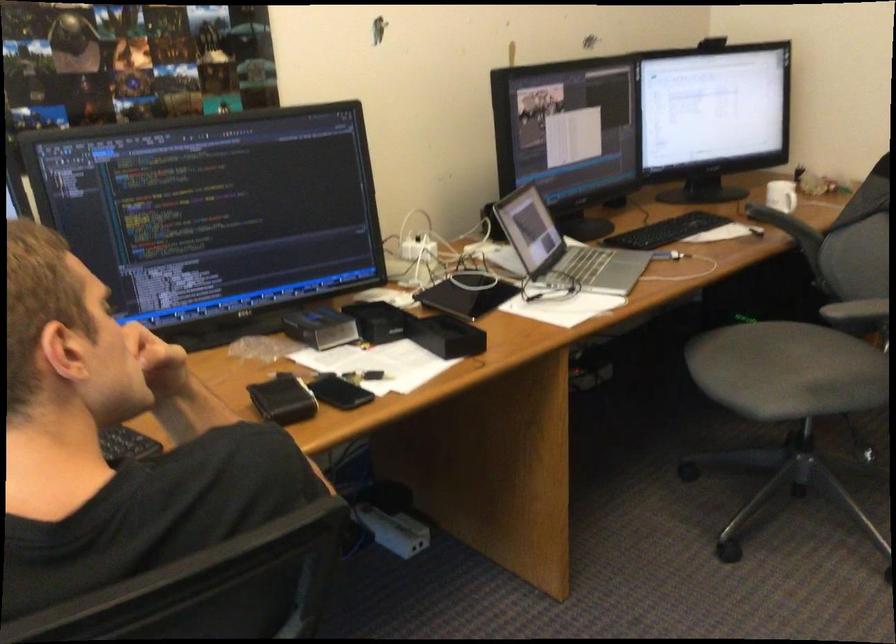
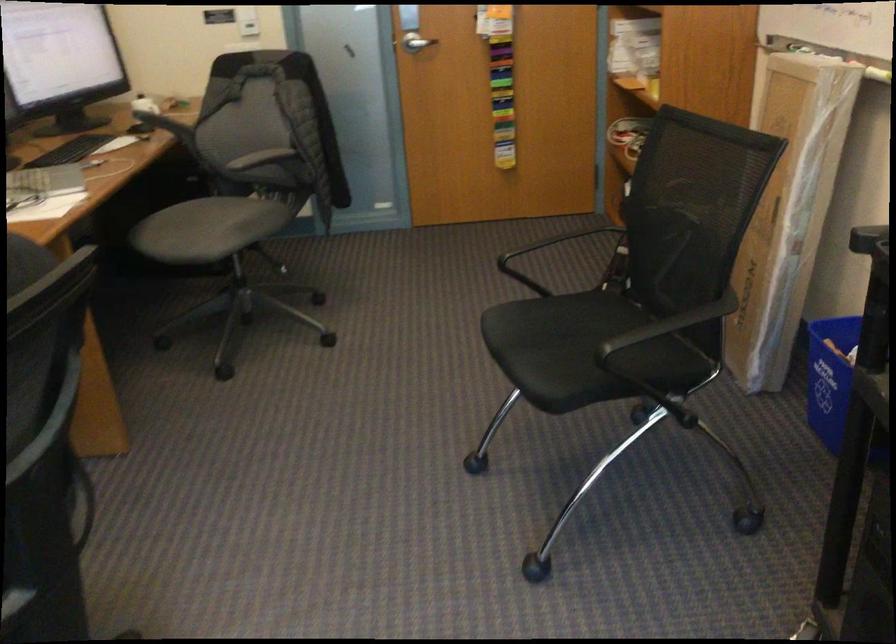
Question: Based on the continuous images, in which direction is the camera rotating? Reply with the corresponding letter.

Choices:
 (A) Left
 (B) Right
 (C) Up
 (D) Down

Answer: (B)